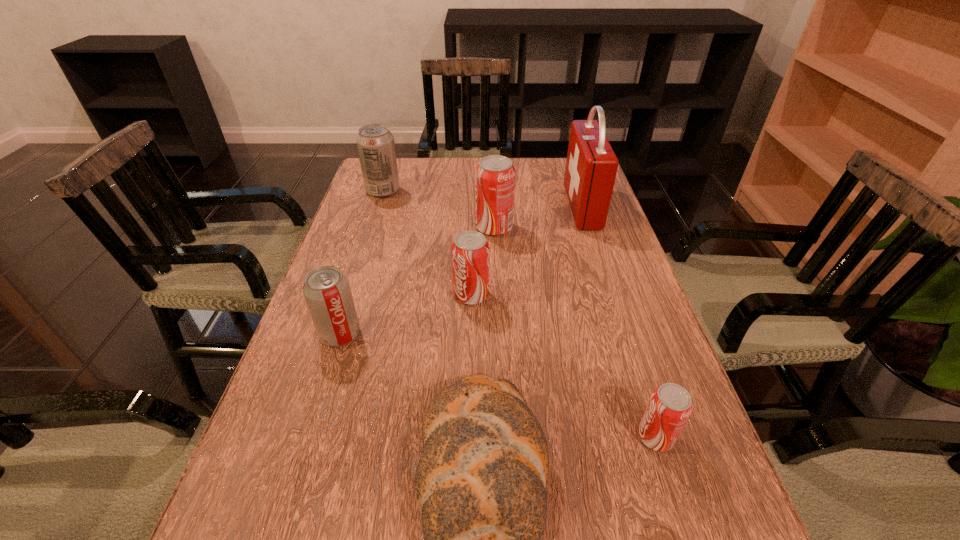
Where is `red first-aid kit`? This screenshot has width=960, height=540. red first-aid kit is located at coordinates (591, 166).

Find the location of a particular element. The width and height of the screenshot is (960, 540). the tallest object is located at coordinates (591, 166).

Where is `the farthest red soda can`? This screenshot has width=960, height=540. the farthest red soda can is located at coordinates (495, 175).

Locate an element on the screen. the biggest red soda can is located at coordinates (495, 175).

This screenshot has height=540, width=960. What are the coordinates of `the farther gray soda can` in the screenshot? It's located at (375, 143).

Where is `the farthest soda can`? Image resolution: width=960 pixels, height=540 pixels. the farthest soda can is located at coordinates (375, 143).

At what (x,y) coordinates should I click in order to perform the action: click on the second nearest soda can. Please return your answer as a coordinate pair (x, y). The height and width of the screenshot is (540, 960). Looking at the image, I should click on (326, 289).

Find the location of a particular element. the nearer gray soda can is located at coordinates (326, 289).

Locate an element on the screen. This screenshot has width=960, height=540. the fourth nearest object is located at coordinates (470, 252).

Where is `the second biggest red soda can`? the second biggest red soda can is located at coordinates click(470, 252).